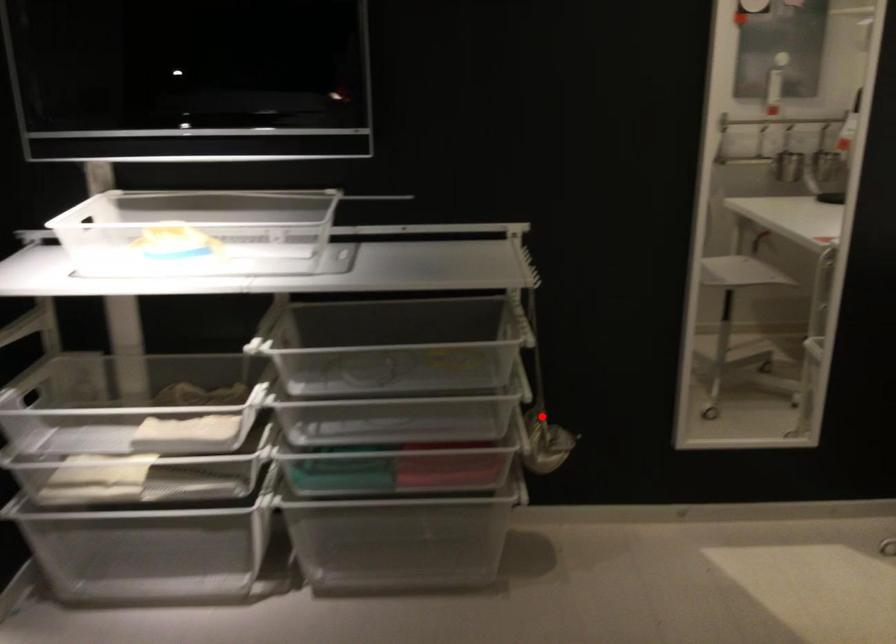
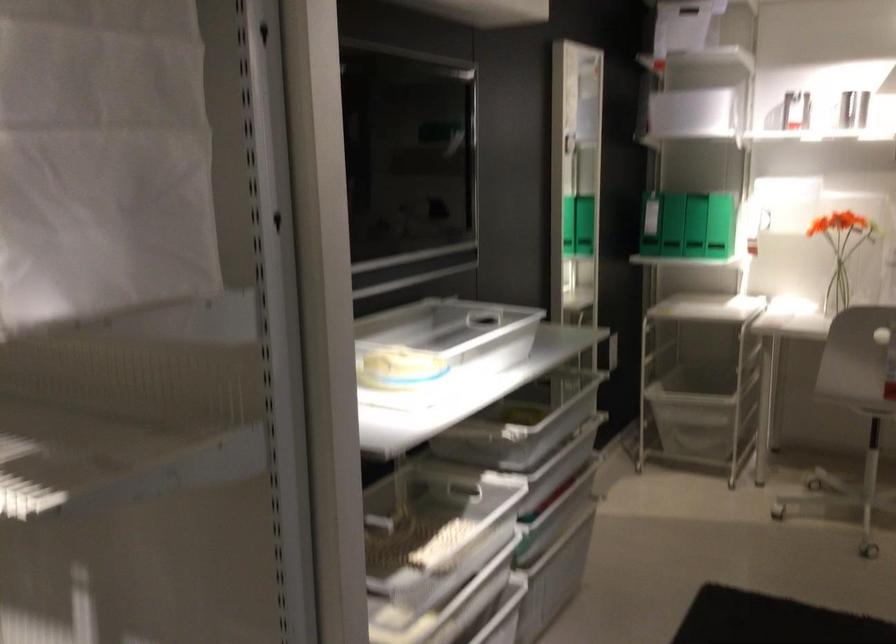
Question: I am providing you with two images of the same scene from different viewpoints. A red point is marked on the first image. Can you still see the location of the red point in image 2?

Choices:
 (A) Yes
 (B) No

Answer: (B)